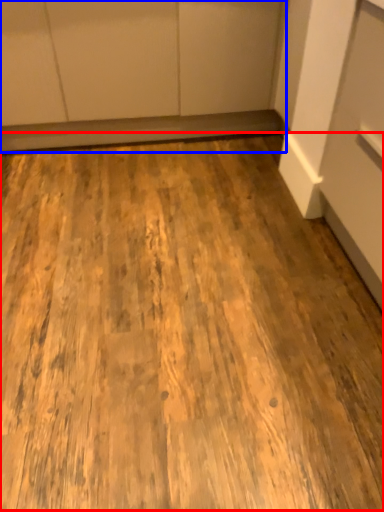
Question: Among these objects, which one is farthest to the camera, plywood (highlighted by a red box) or cabinetry (highlighted by a blue box)?

Choices:
 (A) plywood
 (B) cabinetry

Answer: (B)